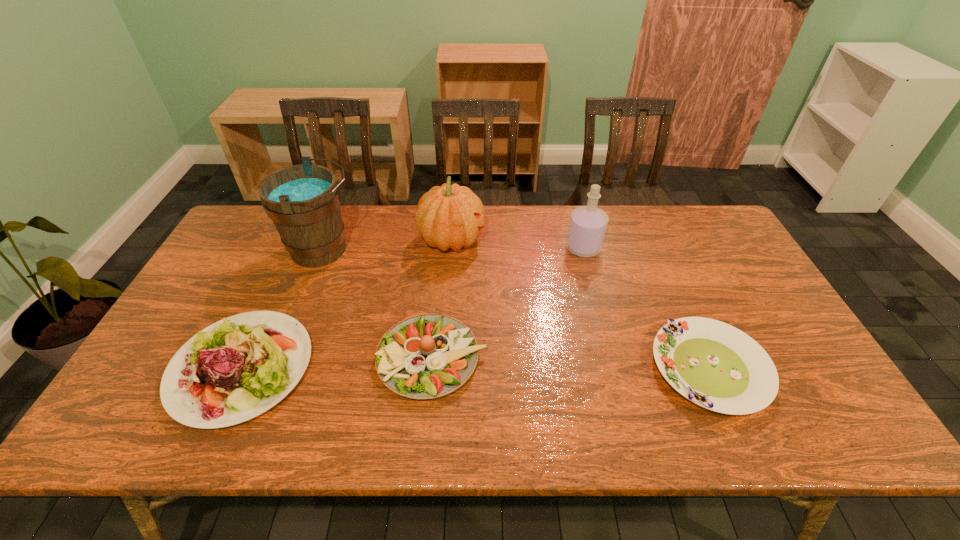
The image size is (960, 540). I want to click on free space located on the left of the second salad plate from left to right, so click(257, 359).

Where is `free spot located on the right of the leftmost salad plate`? This screenshot has height=540, width=960. free spot located on the right of the leftmost salad plate is located at coordinates (461, 368).

Locate an element on the screen. vacant space positioned on the back of the rightmost salad plate is located at coordinates (684, 310).

Where is `wine bucket that is at the far edge`? wine bucket that is at the far edge is located at coordinates (303, 201).

The width and height of the screenshot is (960, 540). Find the location of `perfume located at the far edge`. perfume located at the far edge is located at coordinates coord(588,224).

At what (x,y) coordinates should I click in order to perform the action: click on pumpkin at the far edge. Please return your answer as a coordinate pair (x, y). Looking at the image, I should click on (451, 216).

Locate an element on the screen. This screenshot has height=540, width=960. object at the left edge is located at coordinates (261, 355).

Locate an element on the screen. The image size is (960, 540). object that is positioned at the right edge is located at coordinates (711, 363).

At what (x,y) coordinates should I click in order to perform the action: click on object present at the near left corner. Please return your answer as a coordinate pair (x, y). Looking at the image, I should click on (261, 355).

Identify the location of object positioned at the near right corner. (711, 363).